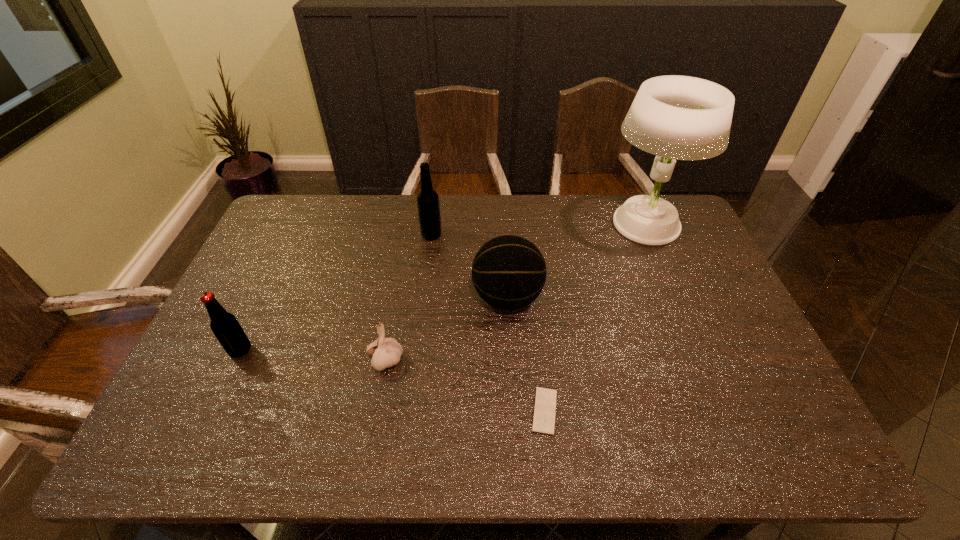
Find the location of a particular element. free location that satisfies the following two spatial constraints: 1. on the front-facing side of the tallest object; 2. on the front side of the basketball is located at coordinates (676, 298).